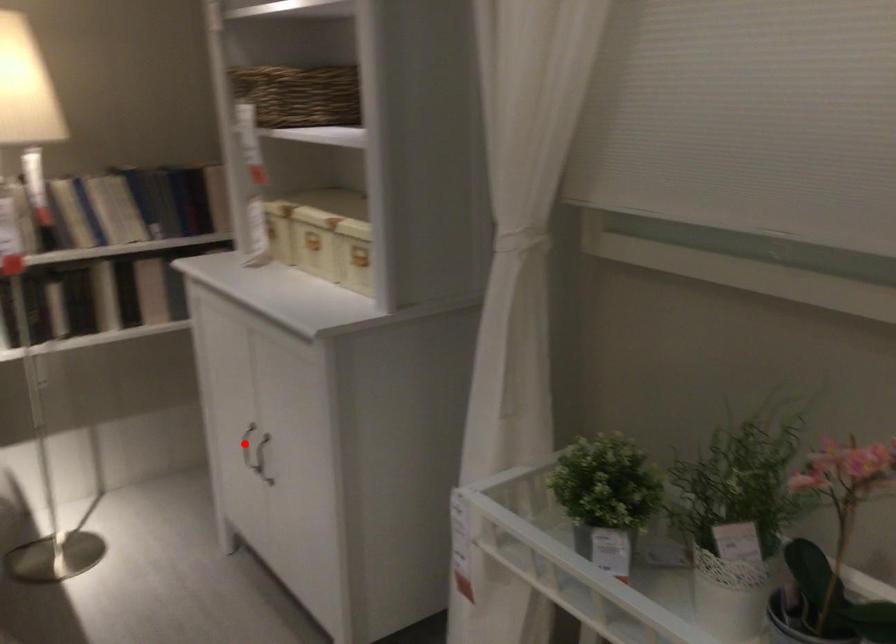
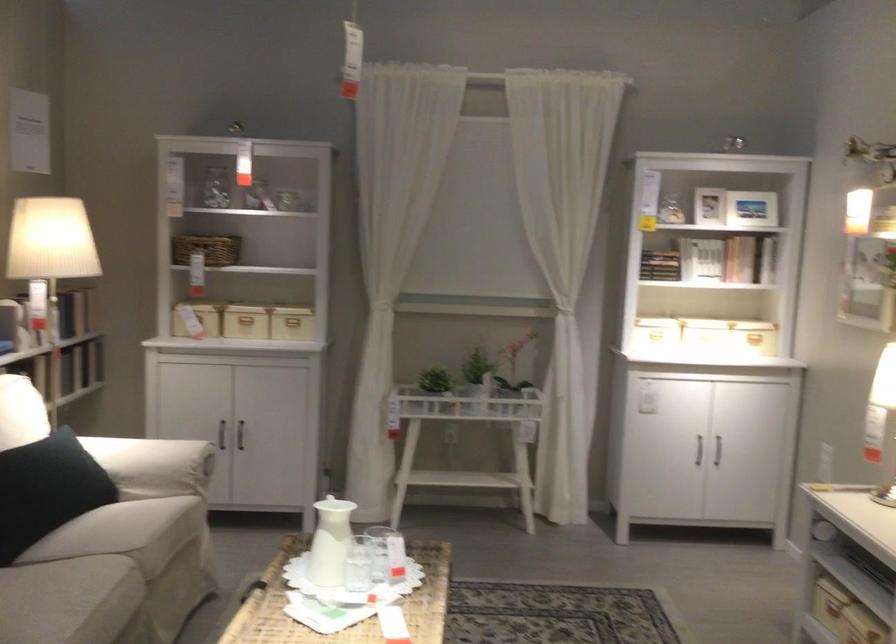
Question: I am providing you with two images of the same scene from different viewpoints. A red point is shown in image1. For the corresponding object point in image2, is it positioned nearer or farther from the camera?

Choices:
 (A) Nearer
 (B) Farther

Answer: (B)